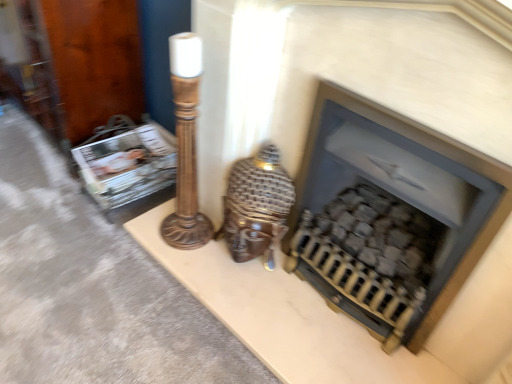
Question: From a real-world perspective, is matte plastic magazine at left beneath brown wooden table lamp at center?

Choices:
 (A) yes
 (B) no

Answer: (A)

Question: Is matte plastic magazine at left at the right side of brown wooden table lamp at center?

Choices:
 (A) no
 (B) yes

Answer: (A)

Question: Is matte plastic magazine at left not inside brown wooden table lamp at center?

Choices:
 (A) yes
 (B) no

Answer: (A)

Question: Can you confirm if matte plastic magazine at left is bigger than brown wooden table lamp at center?

Choices:
 (A) no
 (B) yes

Answer: (A)

Question: Does matte plastic magazine at left come in front of brown wooden table lamp at center?

Choices:
 (A) no
 (B) yes

Answer: (A)

Question: Considering the positions of point (96, 177) and point (438, 203), is point (96, 177) closer or farther from the camera than point (438, 203)?

Choices:
 (A) farther
 (B) closer

Answer: (A)

Question: From the image's perspective, relative to matte black fireplace at center, is matte plastic magazine at left above or below?

Choices:
 (A) below
 (B) above

Answer: (B)

Question: Considering their positions, is matte plastic magazine at left located in front of or behind matte black fireplace at center?

Choices:
 (A) behind
 (B) front

Answer: (A)

Question: From a real-world perspective, is matte plastic magazine at left physically located above or below matte black fireplace at center?

Choices:
 (A) above
 (B) below

Answer: (B)

Question: Considering the positions of brown wooden table lamp at center and matte plastic magazine at left in the image, is brown wooden table lamp at center wider or thinner than matte plastic magazine at left?

Choices:
 (A) wide
 (B) thin

Answer: (B)

Question: Based on their sizes in the image, would you say brown wooden table lamp at center is bigger or smaller than matte plastic magazine at left?

Choices:
 (A) big
 (B) small

Answer: (A)

Question: Considering the positions of brown wooden table lamp at center and matte plastic magazine at left in the image, is brown wooden table lamp at center taller or shorter than matte plastic magazine at left?

Choices:
 (A) tall
 (B) short

Answer: (A)

Question: From a real-world perspective, is brown wooden table lamp at center positioned above or below matte plastic magazine at left?

Choices:
 (A) below
 (B) above

Answer: (B)

Question: Is matte black fireplace at center in front of or behind brown wooden table lamp at center in the image?

Choices:
 (A) behind
 (B) front

Answer: (B)

Question: From the image's perspective, is matte black fireplace at center located above or below brown wooden table lamp at center?

Choices:
 (A) above
 (B) below

Answer: (B)